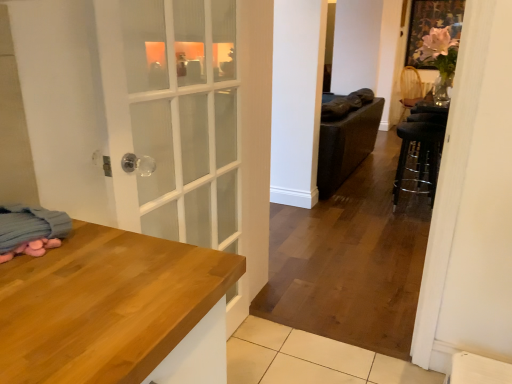
Question: Is blue soft blanket at lower left at the left side of black metal bar stool at right?

Choices:
 (A) no
 (B) yes

Answer: (B)

Question: From a real-world perspective, is blue soft blanket at lower left beneath black metal bar stool at right?

Choices:
 (A) yes
 (B) no

Answer: (B)

Question: Is blue soft blanket at lower left turned away from black metal bar stool at right?

Choices:
 (A) yes
 (B) no

Answer: (B)

Question: Can you confirm if blue soft blanket at lower left is wider than black metal bar stool at right?

Choices:
 (A) yes
 (B) no

Answer: (B)

Question: From a real-world perspective, is blue soft blanket at lower left positioned over black metal bar stool at right based on gravity?

Choices:
 (A) no
 (B) yes

Answer: (B)

Question: Is black metal bar stool at right located within blue soft blanket at lower left?

Choices:
 (A) yes
 (B) no

Answer: (B)

Question: Is black metal bar stool at right oriented towards woven wicker chair at upper right?

Choices:
 (A) no
 (B) yes

Answer: (A)

Question: Is black metal bar stool at right positioned before woven wicker chair at upper right?

Choices:
 (A) no
 (B) yes

Answer: (B)

Question: Is black metal bar stool at right wider than woven wicker chair at upper right?

Choices:
 (A) no
 (B) yes

Answer: (A)

Question: From a real-world perspective, is black metal bar stool at right under woven wicker chair at upper right?

Choices:
 (A) no
 (B) yes

Answer: (B)

Question: Considering the relative sizes of black metal bar stool at right and woven wicker chair at upper right in the image provided, is black metal bar stool at right smaller than woven wicker chair at upper right?

Choices:
 (A) no
 (B) yes

Answer: (B)

Question: Is black metal bar stool at right turned away from woven wicker chair at upper right?

Choices:
 (A) no
 (B) yes

Answer: (A)

Question: From the image's perspective, is black metal bar stool at right on top of blue soft blanket at lower left?

Choices:
 (A) yes
 (B) no

Answer: (A)